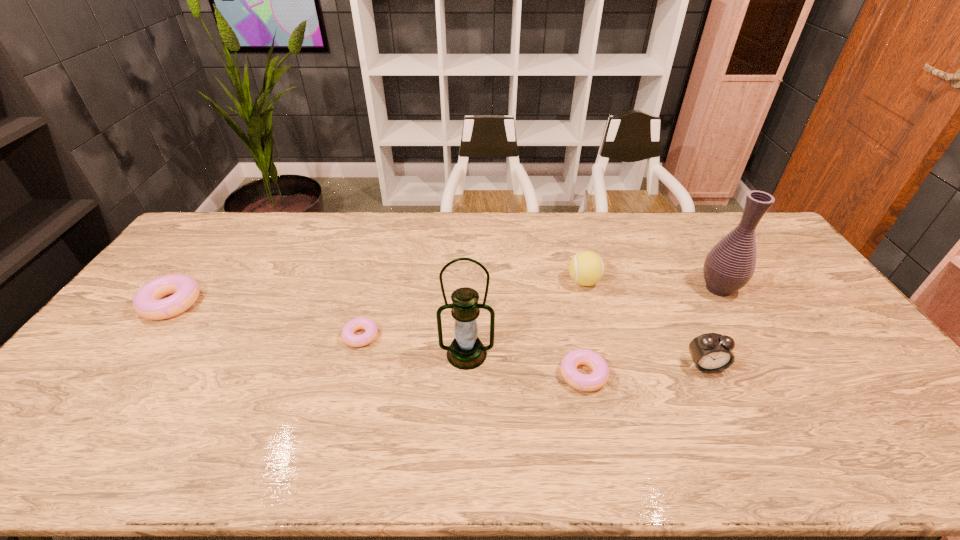
The height and width of the screenshot is (540, 960). Identify the location of blank space located 0.170m on the right of the leftmost object. (255, 303).

Locate an element on the screen. This screenshot has height=540, width=960. vacant space located 0.180m on the left of the shortest object is located at coordinates (280, 336).

The image size is (960, 540). In order to click on vacant point located 0.350m on the back of the sixth tallest object in this screenshot , I will do 562,273.

This screenshot has height=540, width=960. I want to click on free spot located 0.190m on the back of the rightmost object, so click(x=689, y=240).

At what (x,y) coordinates should I click in order to perform the action: click on vacant space located on the left of the tennis ball. Please return your answer as a coordinate pair (x, y). This screenshot has height=540, width=960. Looking at the image, I should click on (444, 282).

Image resolution: width=960 pixels, height=540 pixels. Find the location of `vacant space located 0.070m on the front side of the sixth object from left to right`. vacant space located 0.070m on the front side of the sixth object from left to right is located at coordinates (720, 399).

Where is `vacant space located on the side where the third object from left to right emits light`? This screenshot has width=960, height=540. vacant space located on the side where the third object from left to right emits light is located at coordinates (466, 403).

At what (x,y) coordinates should I click in order to perform the action: click on object that is positioned at the near edge. Please return your answer as a coordinate pair (x, y). Looking at the image, I should click on (585, 382).

Where is `object that is at the left edge`? object that is at the left edge is located at coordinates (146, 303).

In the image, there is a desktop. In order to click on free region at the far edge in this screenshot , I will do point(489,239).